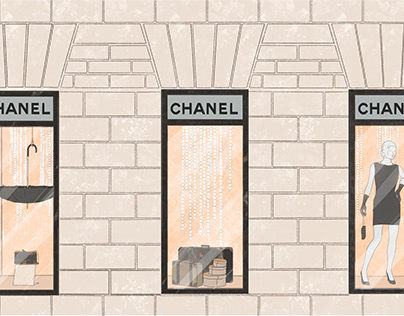
Identify the location of left window. (17, 227).